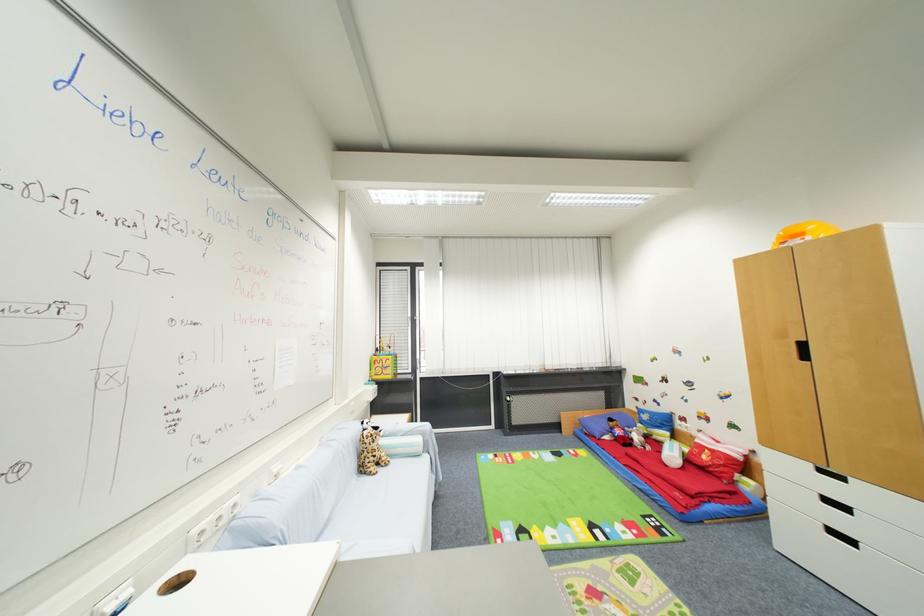
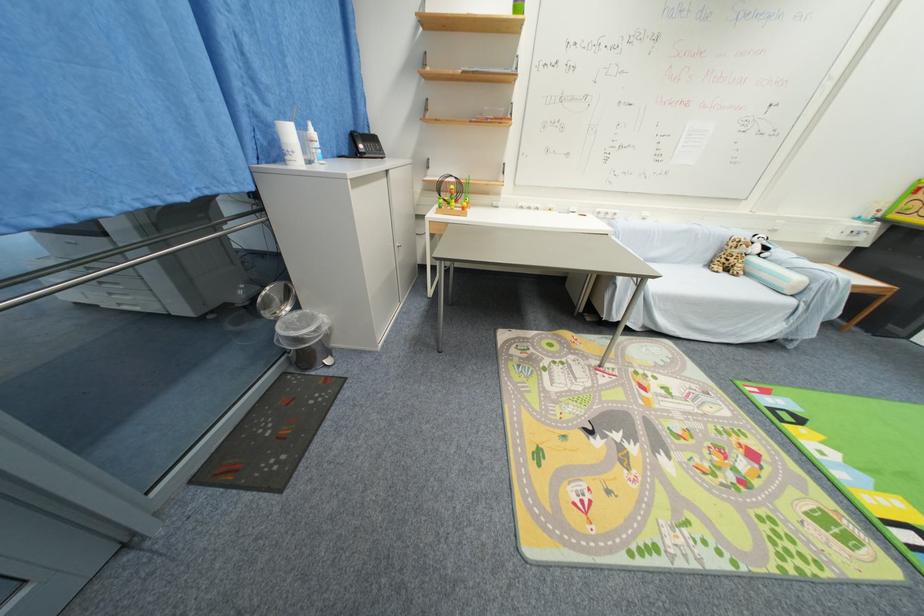
Where in the second image is the point corresponding to pixel 367 472 from the first image?

(714, 265)